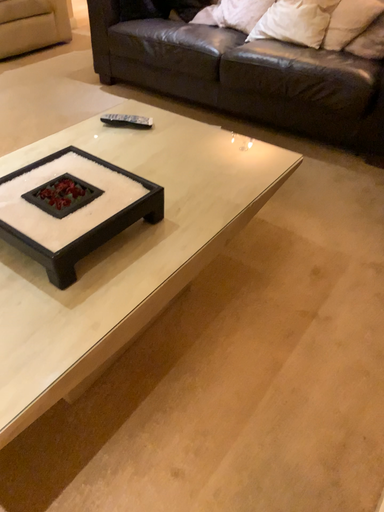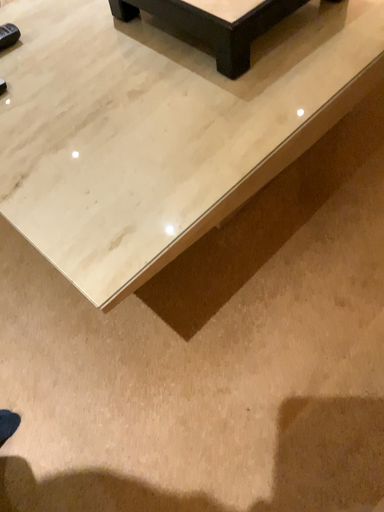
Question: How did the camera likely rotate when shooting the video?

Choices:
 (A) rotated downward
 (B) rotated upward

Answer: (A)